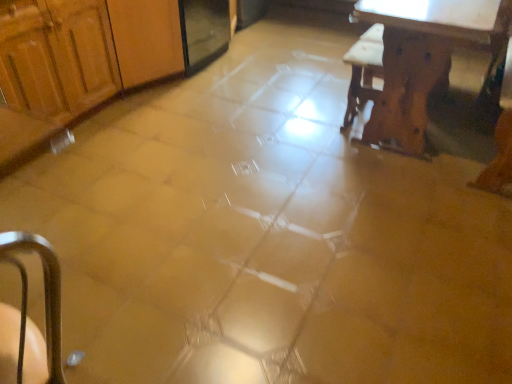
Question: Is wooden cabinet at left spatially inside wooden table at upper right, or outside of it?

Choices:
 (A) inside
 (B) outside

Answer: (B)

Question: Looking at their shapes, would you say wooden cabinet at left is wider or thinner than wooden table at upper right?

Choices:
 (A) wide
 (B) thin

Answer: (B)

Question: Relative to wooden table at upper right, is wooden cabinet at left in front or behind?

Choices:
 (A) front
 (B) behind

Answer: (B)

Question: Is wooden table at upper right inside or outside of wooden cabinet at left?

Choices:
 (A) outside
 (B) inside

Answer: (A)

Question: From a real-world perspective, is wooden table at upper right physically located above or below wooden cabinet at left?

Choices:
 (A) below
 (B) above

Answer: (A)

Question: Considering the positions of wooden table at upper right and wooden cabinet at left in the image, is wooden table at upper right wider or thinner than wooden cabinet at left?

Choices:
 (A) thin
 (B) wide

Answer: (B)

Question: Is point (398, 144) positioned closer to the camera than point (0, 77)?

Choices:
 (A) closer
 (B) farther

Answer: (B)